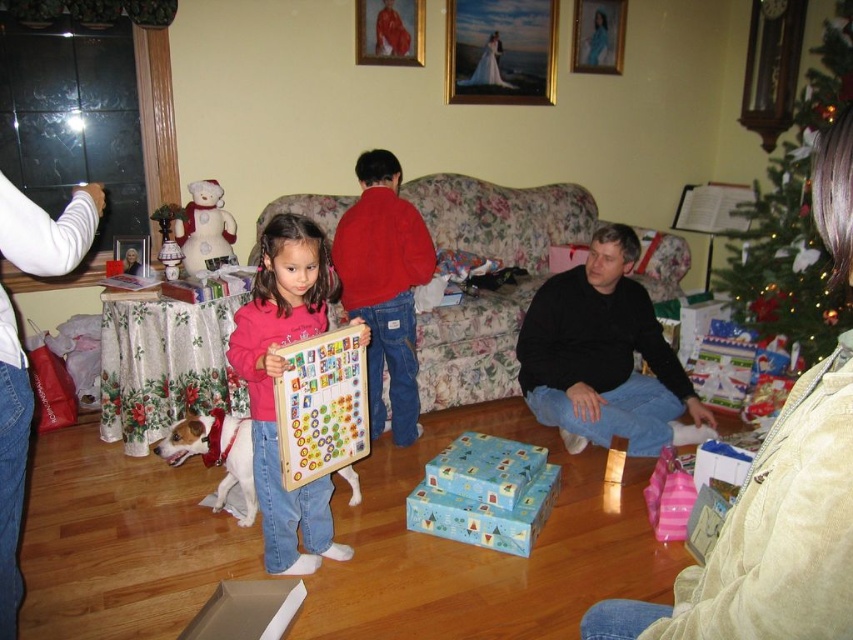
You are planning to hang a new decoration in the room. The decoration needs to be placed above the wooden puzzle board at center but below the matte wooden picture frame at upper center. Is there enough space between them to place the decoration?

The wooden puzzle board at center is located below the matte wooden picture frame at upper center, so there is space between them to place the decoration above the wooden puzzle board at center but below the matte wooden picture frame at upper center.

You are standing in the room and want to place a new decoration on the green textured christmas tree at upper right. According to the image, where exactly should you place it?

The green textured christmas tree at upper right is located at point [793,220], so you should place the decoration at that coordinate.

You are a guest in the house and want to place a new decoration between the wooden puzzle board at center and the matte wooden picture frame at upper center. Based on their positions, where should you place it to be centered between them?

The wooden puzzle board at center is positioned on the left side of matte wooden picture frame at upper center, so placing the decoration halfway between them would require positioning it to the right of the wooden puzzle board at center and to the left of the matte wooden picture frame at upper center.